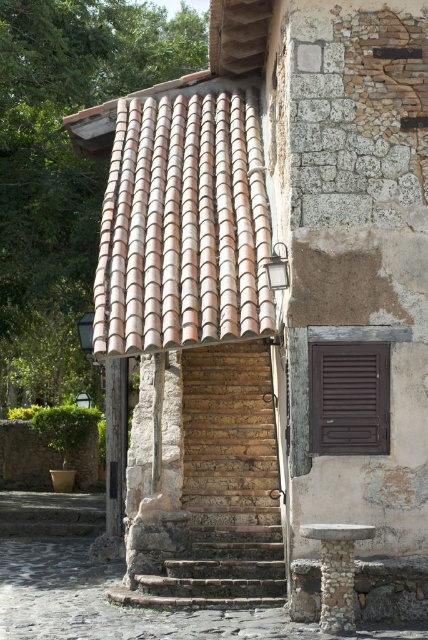
Between point (270, 577) and point (341, 573), which one is positioned behind?

The point (270, 577) is more distant.

Who is more forward, [223,529] or [306,536]?

Point [306,536]

Find the location of a particular element. The width and height of the screenshot is (428, 640). stone textured stairs at center is located at coordinates (219, 572).

You are a GUI agent. You are given a task and a screenshot of the screen. Output one action in this format:
    pyautogui.click(x=<x>, y=<y>)
    Task: Click on the terracotta tiles at upper left
    
    Given the screenshot: What is the action you would take?
    pyautogui.click(x=184, y=224)

Looking at this image, is terracotta tiles at upper left to the right of brown matte shutter at right from the viewer's perspective?

No, terracotta tiles at upper left is not to the right of brown matte shutter at right.

This screenshot has height=640, width=428. Describe the element at coordinates (184, 224) in the screenshot. I see `terracotta tiles at upper left` at that location.

You are a GUI agent. You are given a task and a screenshot of the screen. Output one action in this format:
    pyautogui.click(x=<x>, y=<y>)
    Task: Click on the terracotta tiles at upper left
    
    Given the screenshot: What is the action you would take?
    pyautogui.click(x=184, y=224)

The height and width of the screenshot is (640, 428). Describe the element at coordinates (184, 224) in the screenshot. I see `terracotta tiles at upper left` at that location.

Who is more distant from viewer, (252, 253) or (171, 600)?

The point (252, 253) is behind.

Find the location of a particular element. Image resolution: width=428 pixels, height=640 pixels. terracotta tiles at upper left is located at coordinates (184, 224).